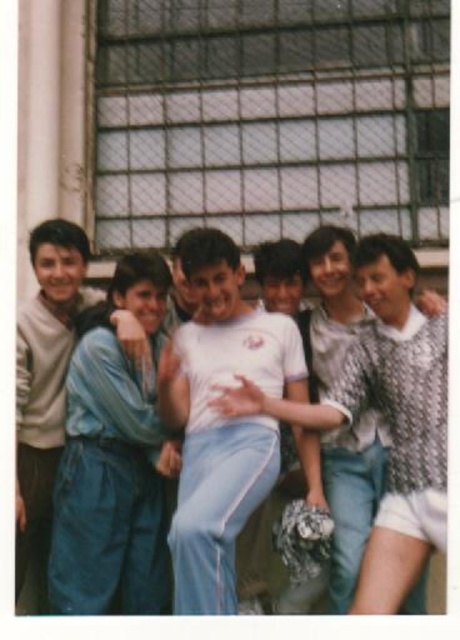
Between blue fabric at center and sweater at left, which one is positioned higher?

Positioned higher is sweater at left.

Can you confirm if blue fabric at center is shorter than sweater at left?

Yes.

The width and height of the screenshot is (460, 640). What do you see at coordinates (114, 465) in the screenshot?
I see `blue fabric at center` at bounding box center [114, 465].

At what (x,y) coordinates should I click in order to perform the action: click on blue fabric at center. Please return your answer as a coordinate pair (x, y). This screenshot has height=640, width=460. Looking at the image, I should click on (114, 465).

Is white matte t-shirt at center to the right of blue fabric at center from the viewer's perspective?

Correct, you'll find white matte t-shirt at center to the right of blue fabric at center.

How distant is white matte t-shirt at center from blue fabric at center?

A distance of 3.29 meters exists between white matte t-shirt at center and blue fabric at center.

Is point (182, 515) positioned in front of point (92, 538)?

Yes, it is in front of point (92, 538).

Find the location of a particular element. white matte t-shirt at center is located at coordinates (220, 417).

Between white cotton shirt at center and sweater at left, which one is positioned higher?

white cotton shirt at center is above.

Is white cotton shirt at center above sweater at left?

Correct, white cotton shirt at center is located above sweater at left.

The height and width of the screenshot is (640, 460). What do you see at coordinates (367, 401) in the screenshot?
I see `white cotton shirt at center` at bounding box center [367, 401].

Find the location of a particular element. This screenshot has width=460, height=640. white cotton shirt at center is located at coordinates (367, 401).